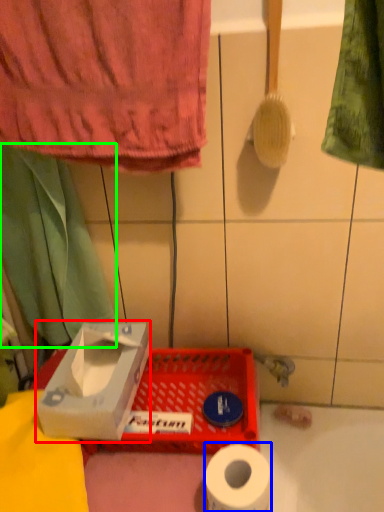
Question: Which object is the closest to the cardboard box (highlighted by a red box)? Choose among these: toilet paper (highlighted by a blue box) or curtain (highlighted by a green box).

Choices:
 (A) toilet paper
 (B) curtain

Answer: (B)